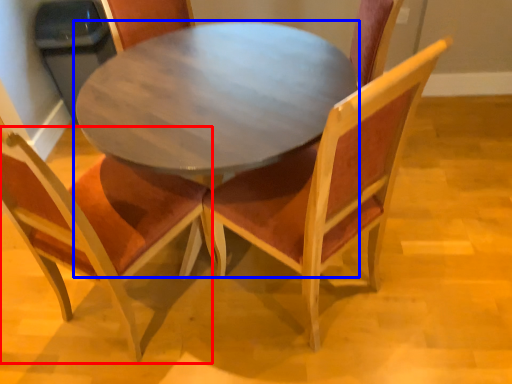
Question: Which point is closer to the camera, chair (highlighted by a red box) or coffee table (highlighted by a blue box)?

Choices:
 (A) chair
 (B) coffee table

Answer: (A)